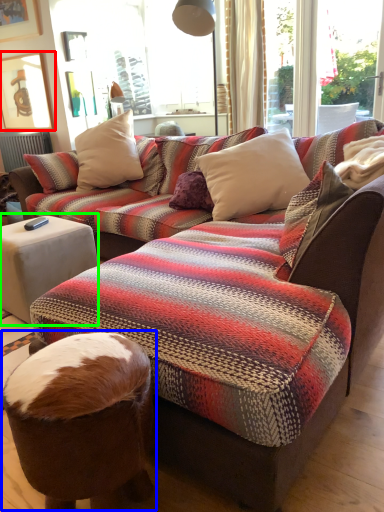
Question: Based on their relative distances, which object is nearer to picture frame (highlighted by a red box)? Choose from bean bag chair (highlighted by a blue box) and side table (highlighted by a green box).

Choices:
 (A) bean bag chair
 (B) side table

Answer: (B)